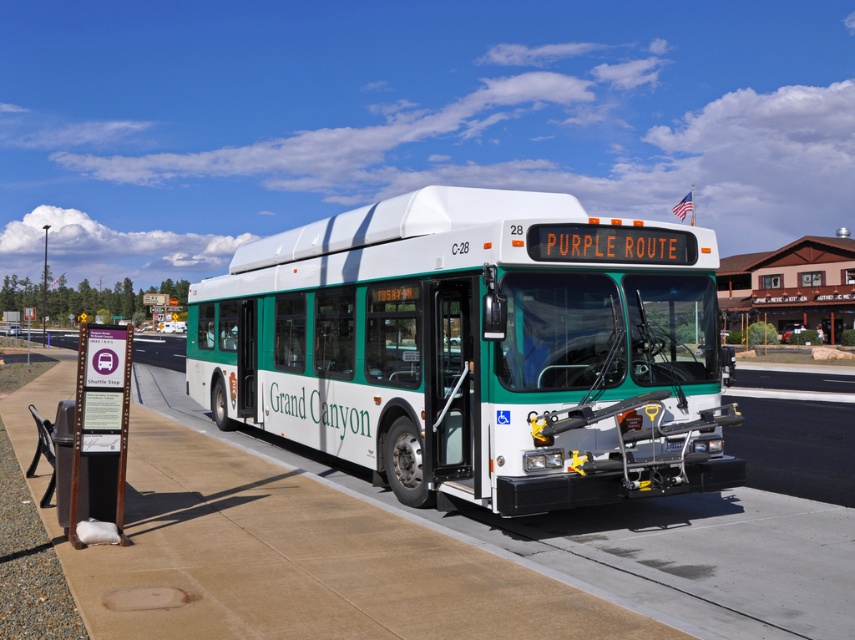
You are a city planner analyzing the placement of public transit stops. Given the coordinates of the green matte bus at center, what is the exact position of the bus in the image?

The green matte bus at center is positioned at coordinates point (476, 348).

You are a visually impaired person using a white cane. You are currently standing on the brown concrete pavement at center and want to reach the white plastic bus stop at center. According to the scene, which direction should you move to reach the bus stop?

The brown concrete pavement at center is to the left of white plastic bus stop at center, so you should move to the right to reach the bus stop.